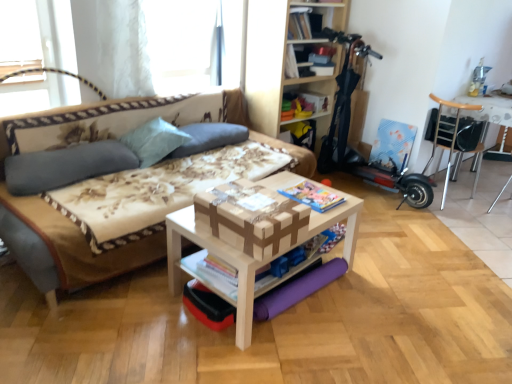
At what (x,y) coordinates should I click in order to perform the action: click on vacant region to the left of white wood table at center, acting as the second table starting from the top. Please return your answer as a coordinate pair (x, y). The height and width of the screenshot is (384, 512). Looking at the image, I should click on (122, 314).